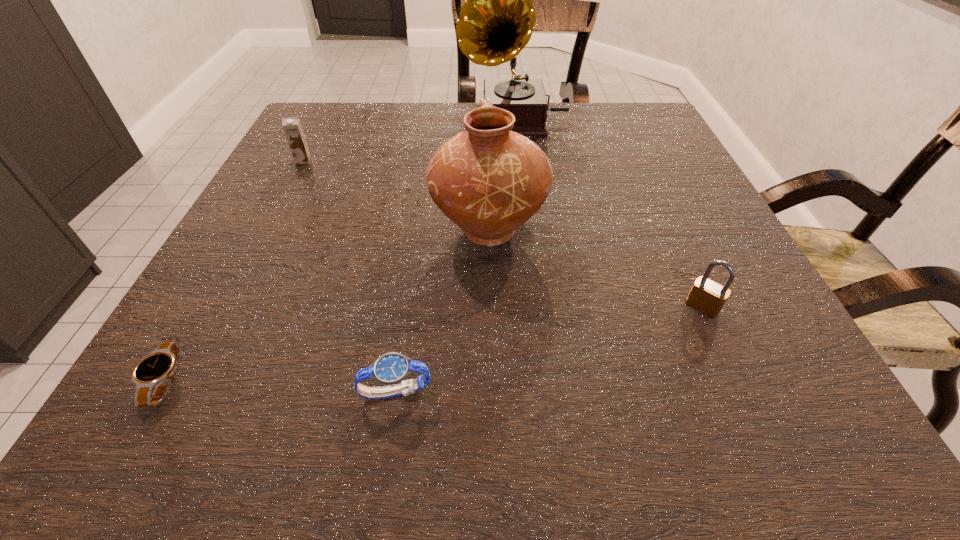
You are a GUI agent. You are given a task and a screenshot of the screen. Output one action in this format:
    pyautogui.click(x=<x>, y=<y>)
    Task: Click on the tallest object
    
    Given the screenshot: What is the action you would take?
    pyautogui.click(x=496, y=22)

Locate an element on the screen. The height and width of the screenshot is (540, 960). the farthest object is located at coordinates (496, 22).

This screenshot has height=540, width=960. I want to click on pottery, so click(x=488, y=180).

Locate an element on the screen. The height and width of the screenshot is (540, 960). the fourth nearest object is located at coordinates (488, 180).

Where is `the second farthest object`? The height and width of the screenshot is (540, 960). the second farthest object is located at coordinates (292, 127).

What are the coordinates of `the rightmost object` in the screenshot? It's located at (708, 297).

I want to click on the fourth farthest object, so click(x=708, y=297).

In order to click on the taller watch in this screenshot , I will do `click(392, 368)`.

What are the coordinates of `the right watch` in the screenshot? It's located at 392,368.

Find the location of a particular element. Image resolution: width=960 pixels, height=540 pixels. the shortest object is located at coordinates click(x=156, y=370).